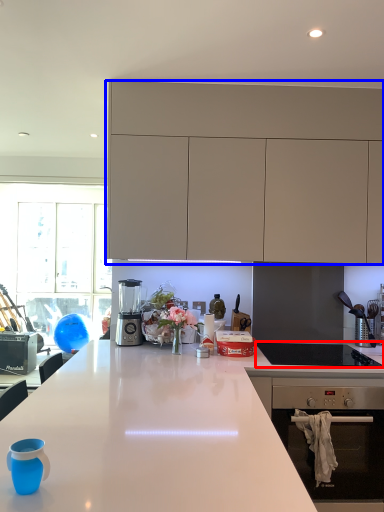
Question: Which of the following is the closest to the observer, gas stove (highlighted by a red box) or cabinetry (highlighted by a blue box)?

Choices:
 (A) gas stove
 (B) cabinetry

Answer: (A)